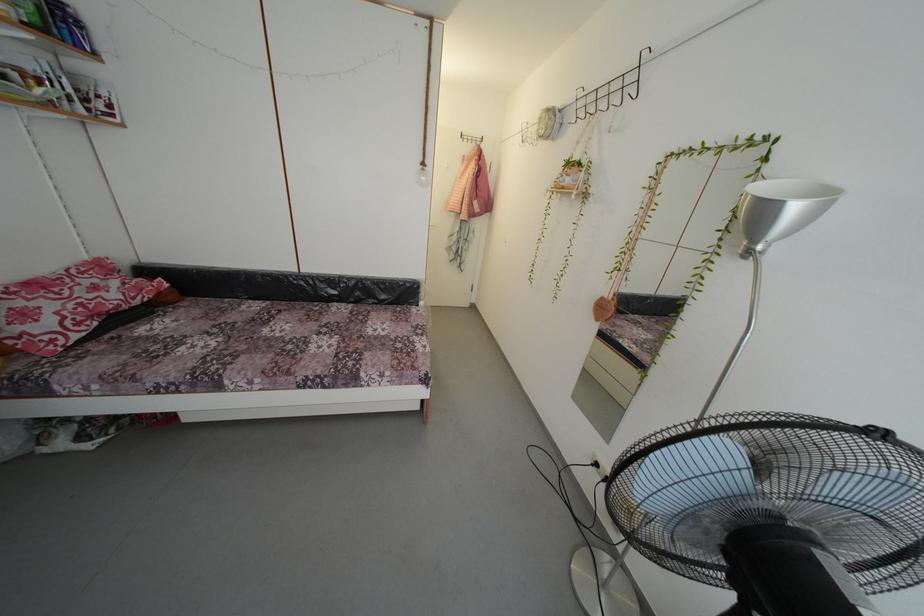
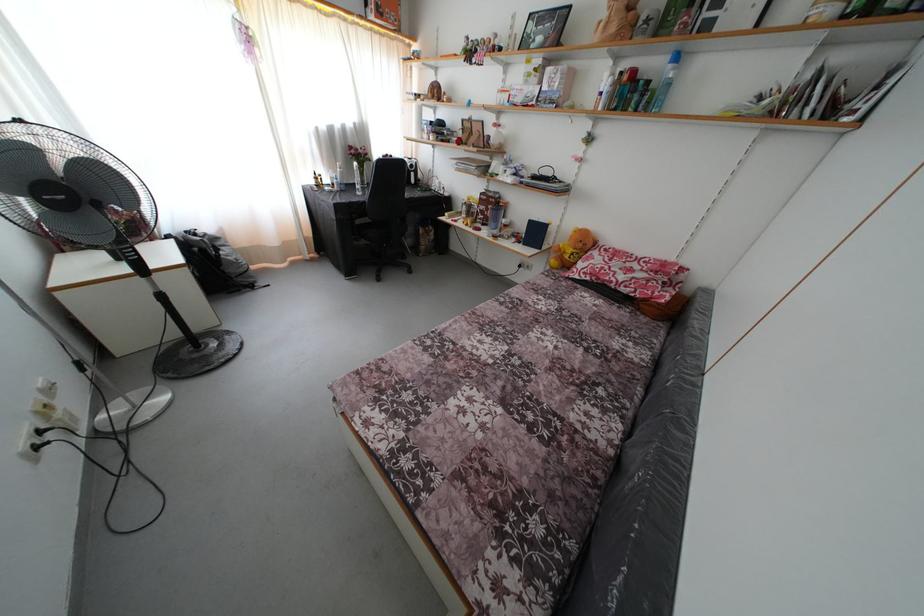
Find the pixel in the second image that matches (66,373) in the first image.

(552, 282)